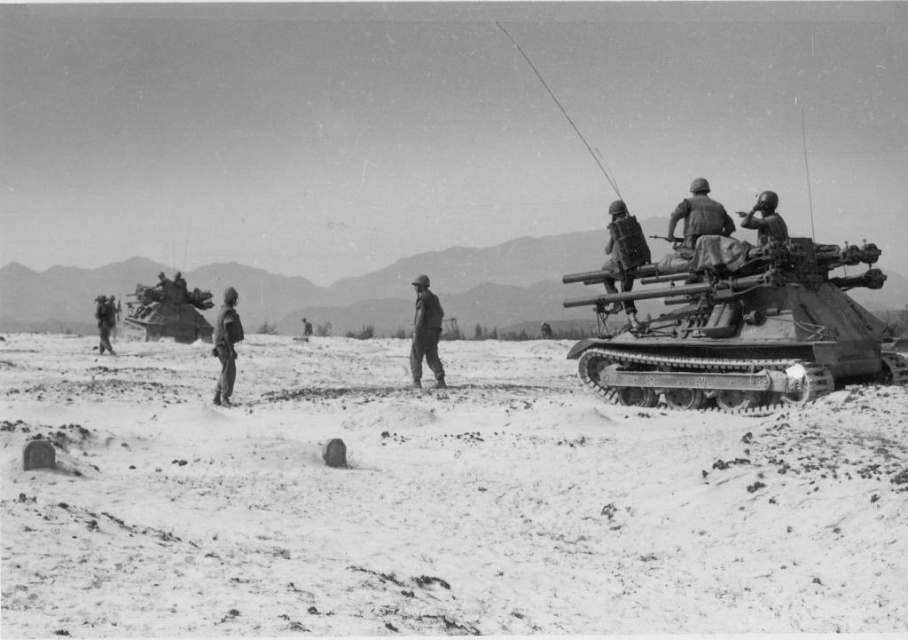
Consider the image. You are a soldier in the military scene. You need to choose a helmet that is shorter to avoid detection. Which helmet should you pick between the matte black helmet at center and the camouflage fabric helmet at left?

The matte black helmet at center is not as tall as the camouflage fabric helmet at left, so you should pick the matte black helmet at center to avoid detection.

You are a drone operator observing the military scene. You need to locate the point at coordinates point (738, 321). Based on the scene description, where is this point located?

The point (738, 321) is located on the metallic tank at right.